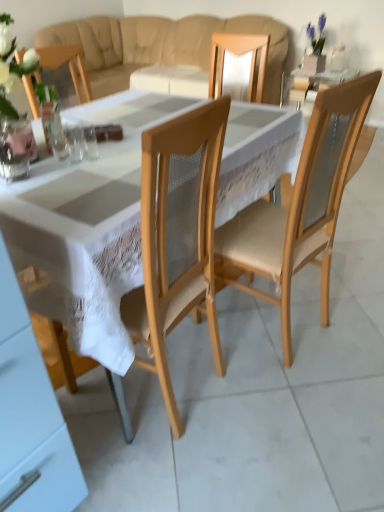
The image size is (384, 512). I want to click on vacant space that's between clear glass cup at center, the third tableware positioned from the left, and clear glass vase at lower left, so click(52, 168).